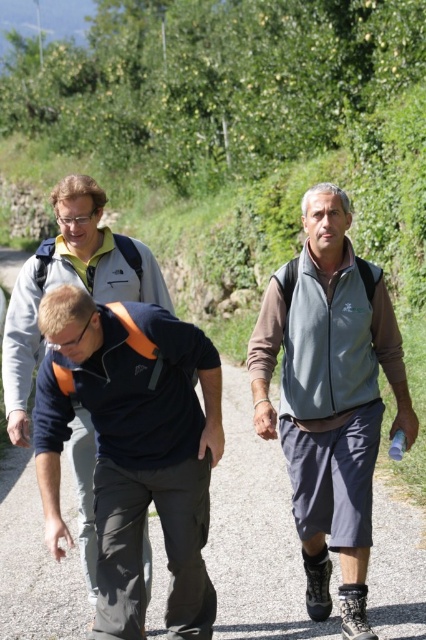
Question: Which object is closer to the camera taking this photo?

Choices:
 (A) matte black jacket at center
 (B) dark blue fabric pants at lower left
 (C) gray fleece vest at center
 (D) dark blue fabric shirt at center

Answer: (B)

Question: Can you confirm if dark blue fabric pants at lower left is smaller than gray fleece vest at center?

Choices:
 (A) no
 (B) yes

Answer: (B)

Question: Estimate the real-world distances between objects in this image. Which object is closer to the gray fleece vest at center?

Choices:
 (A) dark blue fabric shirt at center
 (B) matte black jacket at center
 (C) dark blue fabric pants at lower left

Answer: (C)

Question: Does dark blue fabric shirt at center have a smaller size compared to matte black jacket at center?

Choices:
 (A) no
 (B) yes

Answer: (A)

Question: Can you confirm if dark blue fabric shirt at center is positioned below matte black jacket at center?

Choices:
 (A) yes
 (B) no

Answer: (B)

Question: Which object appears closest to the camera in this image?

Choices:
 (A) dark blue fabric pants at lower left
 (B) gray fleece vest at center
 (C) matte black jacket at center
 (D) dark blue fabric shirt at center

Answer: (A)